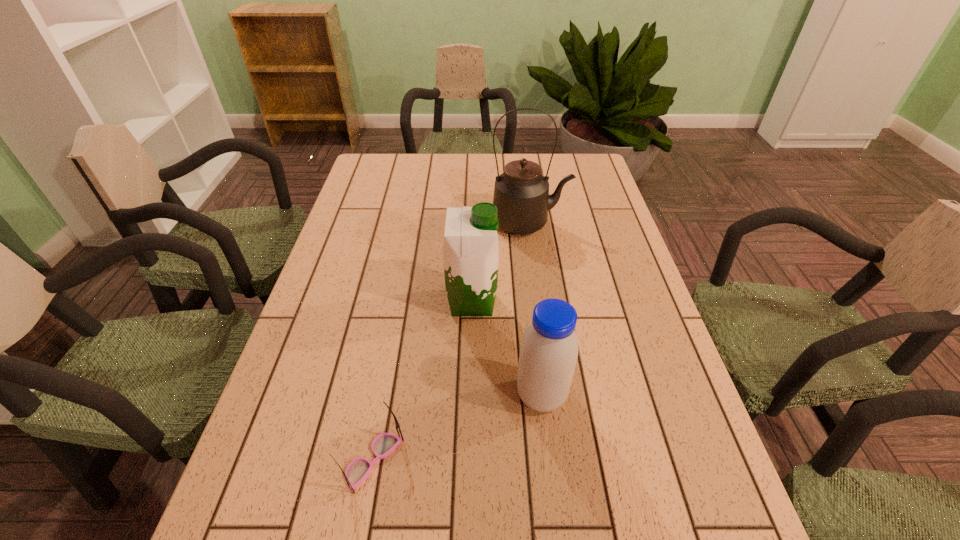
At what (x,y) coordinates should I click in order to perform the action: click on the tallest object. Please return your answer as a coordinate pair (x, y). This screenshot has width=960, height=540. Looking at the image, I should click on pyautogui.click(x=521, y=194).

Find the location of a particular element. Image resolution: width=960 pixels, height=540 pixels. kettle is located at coordinates (521, 194).

Identify the location of the farther soya milk. (470, 244).

Image resolution: width=960 pixels, height=540 pixels. I want to click on the second farthest object, so click(x=470, y=244).

You are a GUI agent. You are given a task and a screenshot of the screen. Output one action in this format:
    pyautogui.click(x=<x>, y=<y>)
    Task: Click on the second nearest object
    The width and height of the screenshot is (960, 540).
    Given the screenshot: What is the action you would take?
    pyautogui.click(x=548, y=354)

Find the location of a particular element. This screenshot has height=540, width=960. the right soya milk is located at coordinates (548, 354).

Locate an element on the screen. spectacles is located at coordinates (358, 470).

The width and height of the screenshot is (960, 540). Identify the location of the nearest object. (358, 470).

The image size is (960, 540). In order to click on vacant space situated spout on the kettle in this screenshot , I will do `click(585, 223)`.

This screenshot has width=960, height=540. Identify the location of free space located 0.060m on the front-facing side of the farther soya milk. (521, 302).